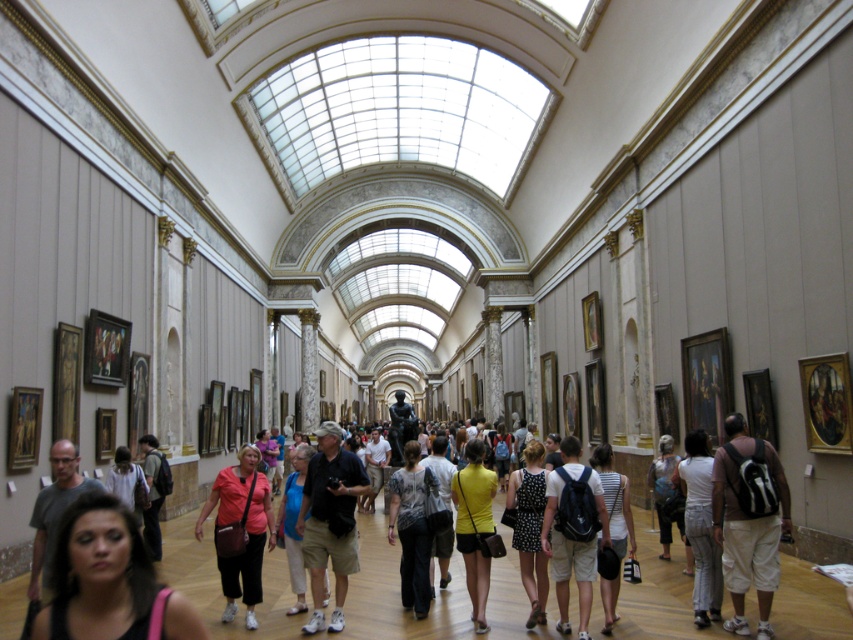
Question: Is white textured blouse at center wider than denim shorts at center?

Choices:
 (A) yes
 (B) no

Answer: (B)

Question: Which object appears farthest from the camera in this image?

Choices:
 (A) light pink fabric shirt at center
 (B) pink fabric purse at center
 (C) dark gray backpack at center
 (D) light blue cotton shirt at center

Answer: (D)

Question: Among these points, which one is farthest from the camera?

Choices:
 (A) (666, 465)
 (B) (108, 493)
 (C) (148, 497)
 (D) (294, 472)

Answer: (A)

Question: Based on their relative distances, which object is nearer to the light pink fabric shirt at center?

Choices:
 (A) polka dot dress at center
 (B) white cotton pants at lower right
 (C) light blue cotton shirt at center
 (D) white textured blouse at center

Answer: (C)

Question: Does matte black top at center appear on the left side of dark gray backpack at center?

Choices:
 (A) no
 (B) yes

Answer: (A)

Question: From the image, what is the correct spatial relationship of white cotton pants at lower right in relation to denim shorts at center?

Choices:
 (A) above
 (B) below

Answer: (B)